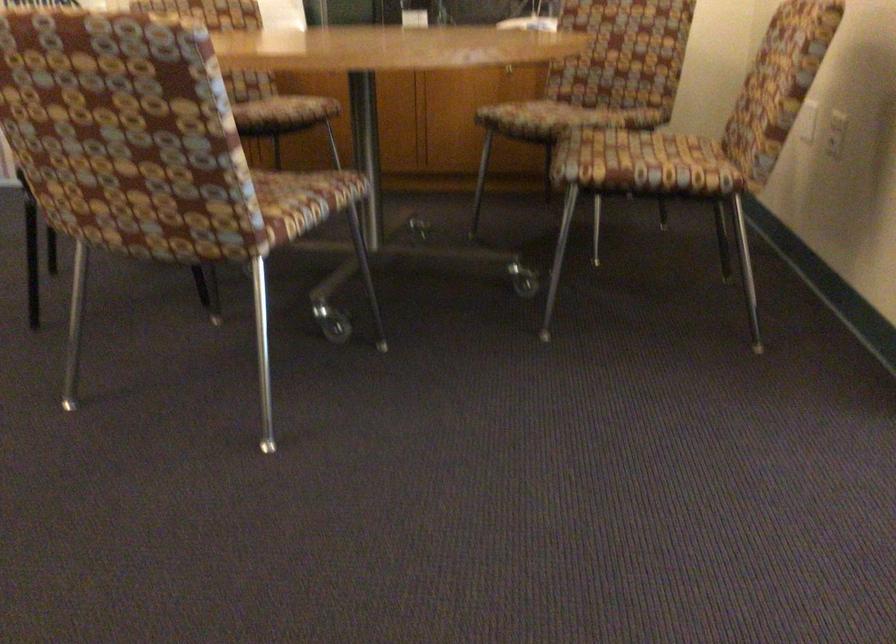
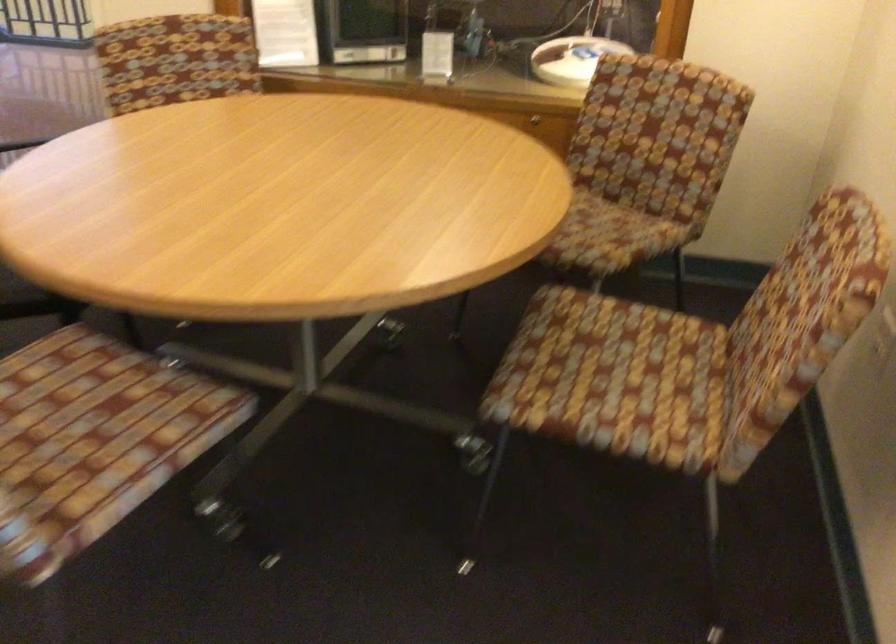
Question: Based on the continuous images, in which direction is the camera rotating? Reply with the corresponding letter.

Choices:
 (A) Left
 (B) Right
 (C) Up
 (D) Down

Answer: (D)